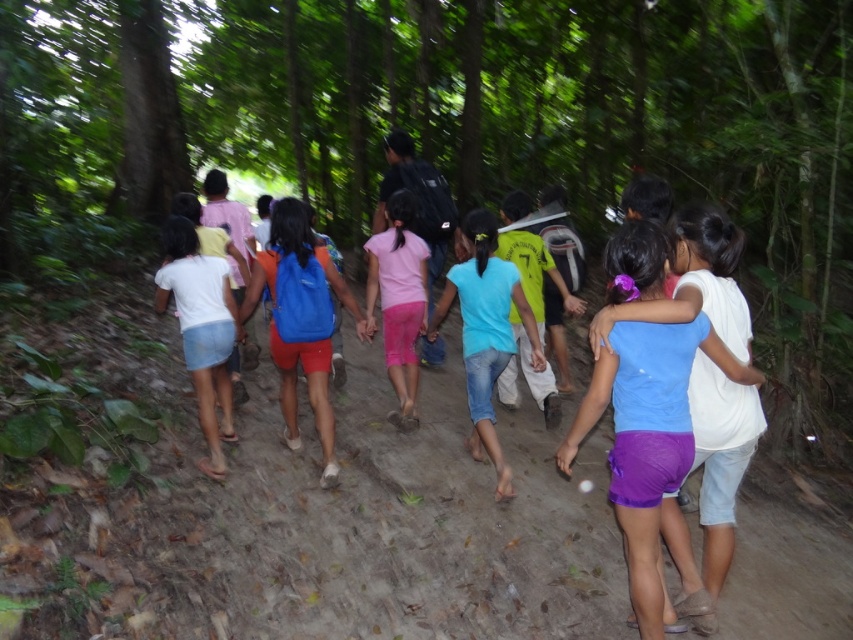
From the picture: Is matte blue shirt at center smaller than blue fabric backpack at center?

Indeed, matte blue shirt at center has a smaller size compared to blue fabric backpack at center.

Does matte blue shirt at center have a lesser height compared to blue fabric backpack at center?

Yes, matte blue shirt at center is shorter than blue fabric backpack at center.

Between point (660, 568) and point (302, 276), which one is positioned in front?

Point (660, 568) is more forward.

Where is `matte blue shirt at center`? The image size is (853, 640). matte blue shirt at center is located at coordinates (648, 442).

How distant is matte blue shirt at center from pink matte shorts at center?

They are 8.88 feet apart.

Is point (616, 241) farther from viewer compared to point (403, 276)?

No.

Who is more distant from viewer, (x=613, y=472) or (x=399, y=236)?

Positioned behind is point (x=399, y=236).

I want to click on matte blue shirt at center, so click(x=648, y=442).

Consider the image. Is matte blue shirt at center wider than blue denim shorts at center?

Indeed, matte blue shirt at center has a greater width compared to blue denim shorts at center.

Who is lower down, matte blue shirt at center or blue denim shorts at center?

matte blue shirt at center is below.

Does point (675, 484) come in front of point (496, 365)?

That is True.

The height and width of the screenshot is (640, 853). What are the coordinates of `matte blue shirt at center` in the screenshot? It's located at (648, 442).